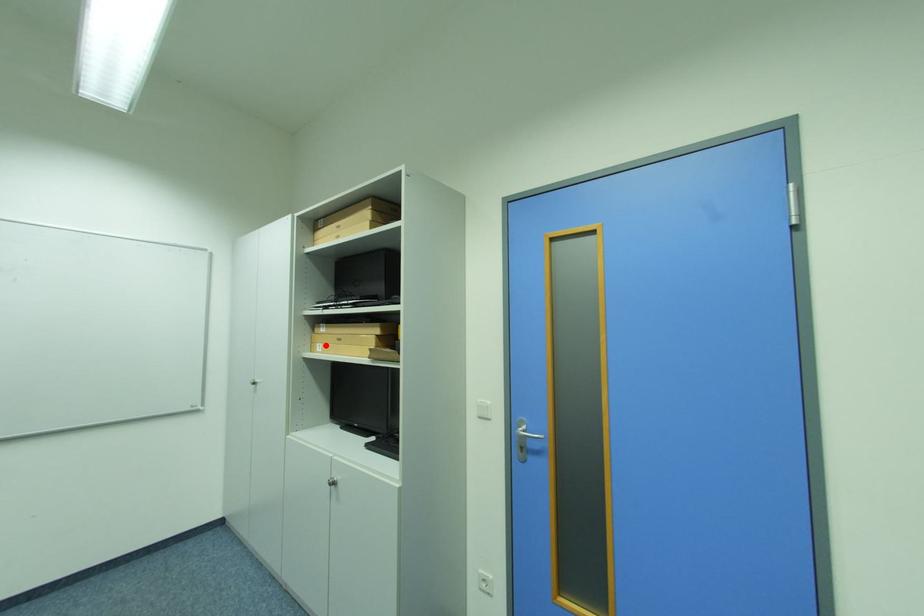
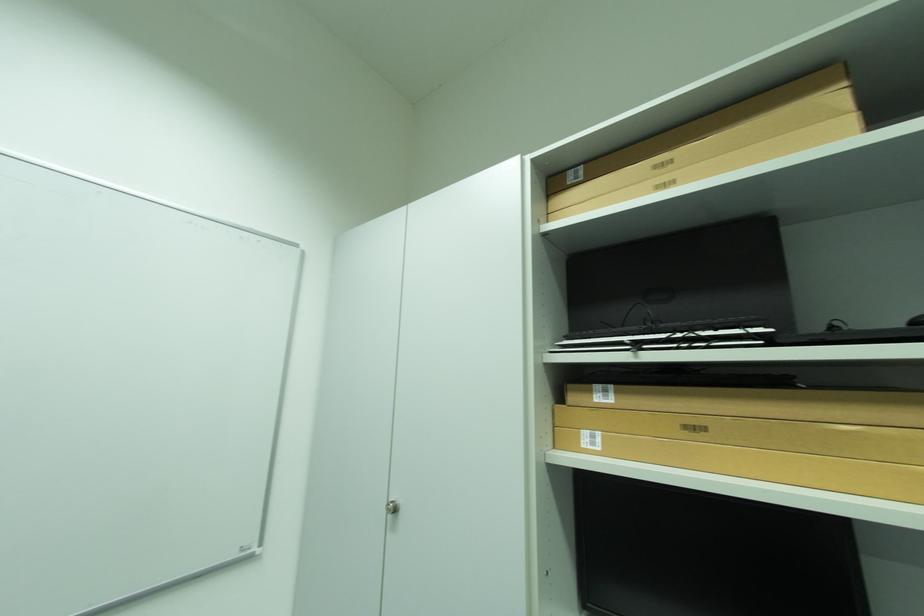
Find the pixel in the second image that matches the highlighted location in the first image.

(593, 434)